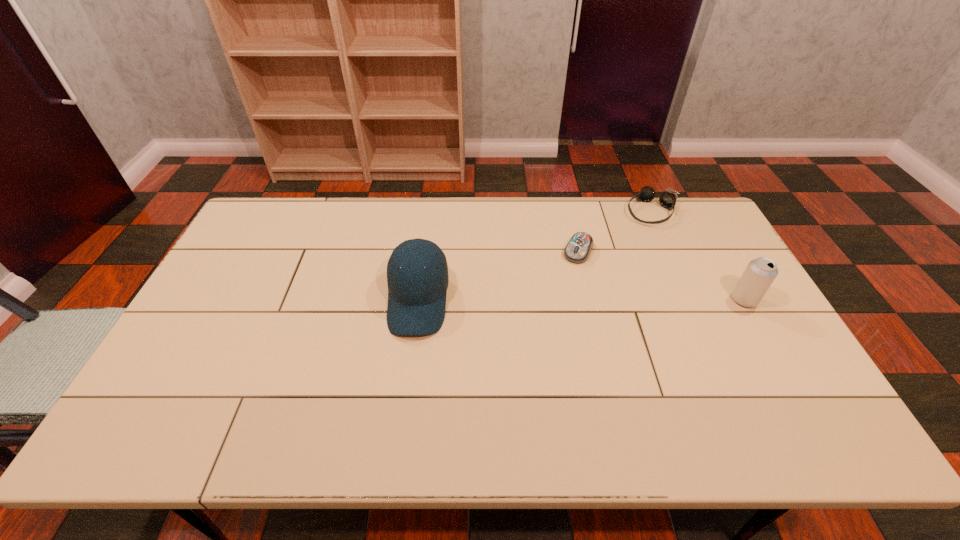
Locate an element on the screen. The height and width of the screenshot is (540, 960). free space on the desktop that is between the leftmost object and the beer can and is positioned on the wheel side of the computer mouse is located at coordinates (552, 300).

Locate an element on the screen. The width and height of the screenshot is (960, 540). free spot on the desktop that is between the baseball cap and the beer can and is positioned through the lenses of the farthest object is located at coordinates (610, 300).